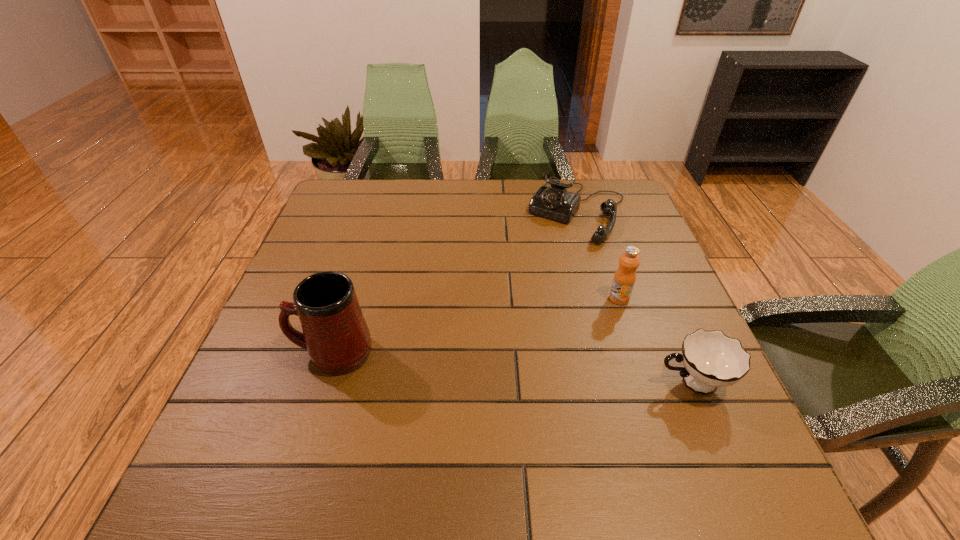
Where is `vacant region at the far left corner of the desktop`? vacant region at the far left corner of the desktop is located at coordinates (340, 191).

Find the location of `blank area at the near left corner`. blank area at the near left corner is located at coordinates (292, 443).

The width and height of the screenshot is (960, 540). I want to click on free space that is in between the orange juice and the cup, so pos(656,341).

Locate an element on the screen. This screenshot has height=540, width=960. free area in between the mug and the cup is located at coordinates (513, 368).

Locate an element on the screen. vacant space in between the cup and the farthest object is located at coordinates (635, 296).

This screenshot has width=960, height=540. Identify the location of unoccupied area between the cup and the second tallest object. (656, 341).

You are a GUI agent. You are given a task and a screenshot of the screen. Output one action in this format:
    pyautogui.click(x=<x>, y=<y>)
    Task: Click on the vacant area that lies between the leftmost object and the third shortest object
    The image size is (960, 540).
    Given the screenshot: What is the action you would take?
    pyautogui.click(x=476, y=326)

Where is `free spot between the farthest object and the second farthest object`? The width and height of the screenshot is (960, 540). free spot between the farthest object and the second farthest object is located at coordinates [x=598, y=254].

Image resolution: width=960 pixels, height=540 pixels. Find the location of `vacant space that's between the cup and the telephone`. vacant space that's between the cup and the telephone is located at coordinates 635,296.

Find the location of a particular element. empty space between the farthest object and the second tallest object is located at coordinates coord(598,254).